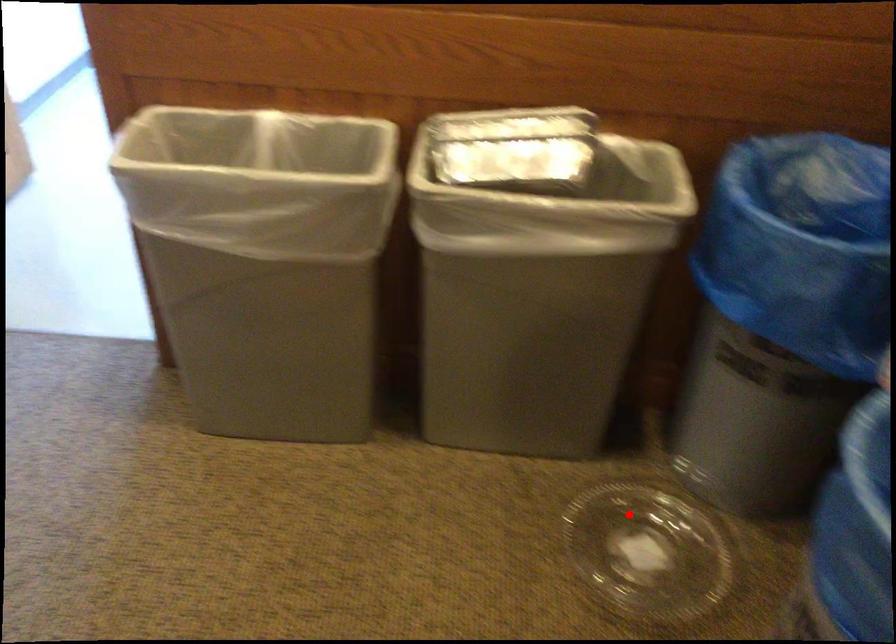
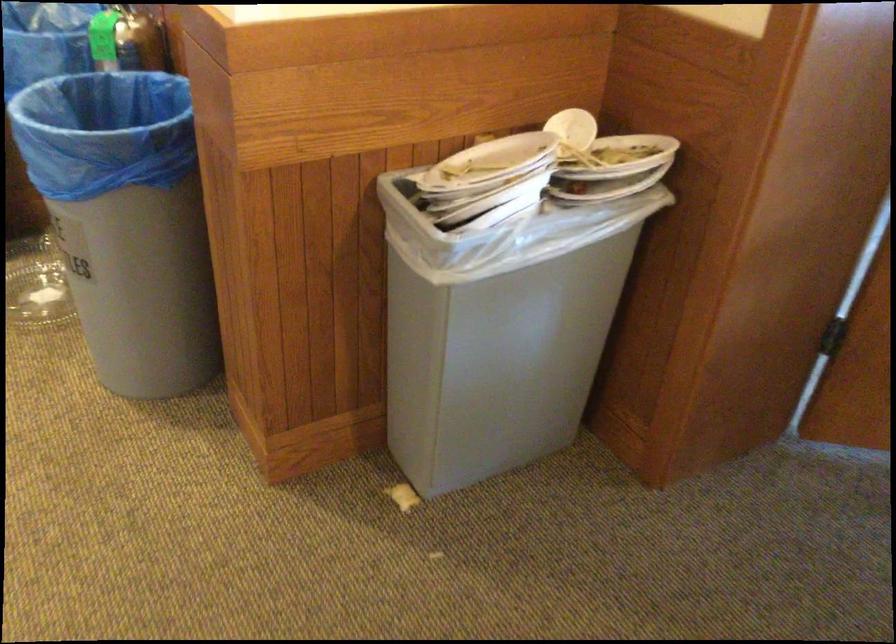
Question: A red point is marked in image1. In image2, is the corresponding 3D point closer to the camera or farther? Reply with the corresponding letter.

Choices:
 (A) The corresponding 3D point is closer.
 (B) The corresponding 3D point is farther.

Answer: (B)